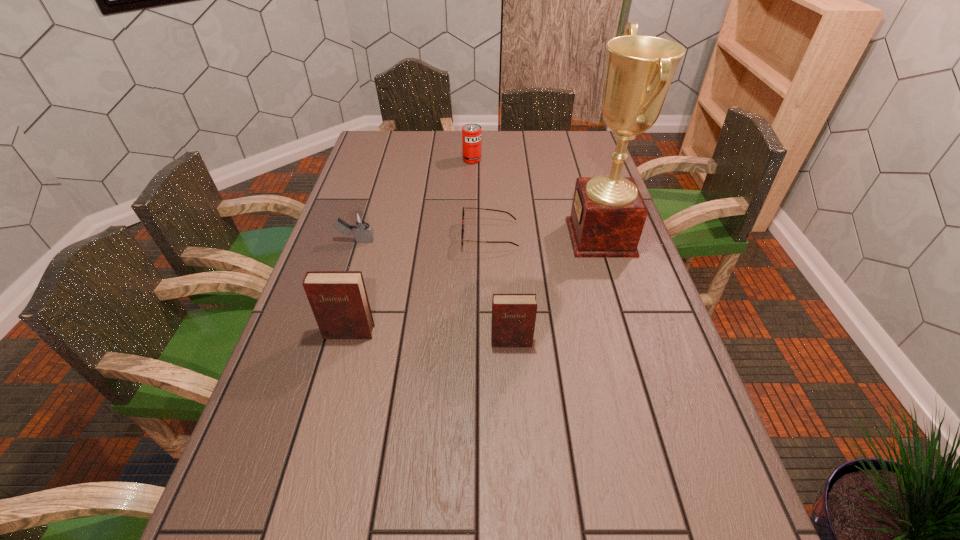
In the current image, all diarys are evenly spaced. To maintain this equal spacing, where should an additional diary be placed on the right? Please point out a free spot. Please provide its 2D coordinates. Your answer should be formatted as a tuple, i.e. [(x, y)], where the tuple contains the x and y coordinates of a point satisfying the conditions above.

[(681, 352)]